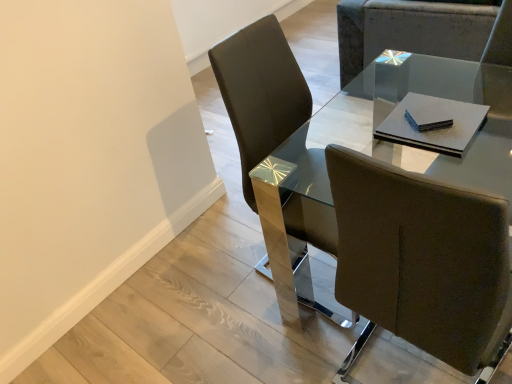
What is the approximate height of brown leather chair at center, the second chair when ordered from back to front?

It is 3.39 feet.

This screenshot has height=384, width=512. Identify the location of glass/metal table at center. (372, 156).

Find the location of a particular element. The height and width of the screenshot is (384, 512). matte brown chair at upper right, which is counted as the 1th chair, starting from the back is located at coordinates (411, 30).

Is glass/metal table at center thinner than brown leather chair at center, which is the 2th chair from right to left?

In fact, glass/metal table at center might be wider than brown leather chair at center, which is the 2th chair from right to left.

From the picture: Considering the sizes of objects glass/metal table at center and brown leather chair at center, which is the 2th chair from right to left, in the image provided, who is shorter, glass/metal table at center or brown leather chair at center, which is the 2th chair from right to left,?

glass/metal table at center.

Which object is positioned more to the left, glass/metal table at center or brown leather chair at center, which is the 2th chair from right to left?

brown leather chair at center, which is the 2th chair from right to left, is more to the left.

Identify the location of the 1st chair behind the glass/metal table at center, starting your count from the anchor. The image size is (512, 384). (260, 92).

Which is in front, point (275, 34) or point (271, 217)?

Point (271, 217)

From the image's perspective, which chair is the 1st one above the glass/metal table at center? Please provide its 2D coordinates.

[(260, 92)]

Is brown leather chair at center, the first chair when ordered from left to right, with glass/metal table at center?

No, brown leather chair at center, the first chair when ordered from left to right, is not beside glass/metal table at center.

From their relative heights in the image, would you say brown leather chair at center, the first chair when ordered from bottom to top, is taller or shorter than glass/metal table at center?

Considering their sizes, brown leather chair at center, the first chair when ordered from bottom to top, has more height than glass/metal table at center.

Is brown leather chair at center, which ranks as the 2th chair in top-to-bottom order, facing towards matte brown chair at upper right, the 1th chair positioned from the right?

No.

Is brown leather chair at center, the first chair when ordered from bottom to top, to the left of matte brown chair at upper right, which is counted as the 2th chair, starting from the bottom, from the viewer's perspective?

Yes, brown leather chair at center, the first chair when ordered from bottom to top, is to the left of matte brown chair at upper right, which is counted as the 2th chair, starting from the bottom.

In terms of size, does brown leather chair at center, arranged as the first chair when viewed from the front, appear bigger or smaller than matte brown chair at upper right, which is the 1th chair from top to bottom?

brown leather chair at center, arranged as the first chair when viewed from the front, is smaller than matte brown chair at upper right, which is the 1th chair from top to bottom.

Visually, is matte brown chair at upper right, which is counted as the 1th chair, starting from the back, positioned to the left or to the right of brown leather chair at center, which is the 2th chair from right to left?

Based on their positions, matte brown chair at upper right, which is counted as the 1th chair, starting from the back, is located to the right of brown leather chair at center, which is the 2th chair from right to left.

Is matte brown chair at upper right, the 1th chair positioned from the right, far away from brown leather chair at center, the first chair when ordered from left to right?

Yes, matte brown chair at upper right, the 1th chair positioned from the right, and brown leather chair at center, the first chair when ordered from left to right, are located far from each other.

From a real-world perspective, which is physically above, matte brown chair at upper right, which is the 1th chair from top to bottom, or brown leather chair at center, which ranks as the 2th chair in top-to-bottom order?

In real-world perspective, brown leather chair at center, which ranks as the 2th chair in top-to-bottom order, is above.

Who is shorter, matte brown chair at upper right, which is the 1th chair from top to bottom, or brown leather chair at center, the second chair when ordered from back to front?

Standing shorter between the two is matte brown chair at upper right, which is the 1th chair from top to bottom.

Is glass/metal table at center in front of or behind matte brown chair at upper right, which ranks as the second chair in left-to-right order, in the image?

Clearly, glass/metal table at center is in front of matte brown chair at upper right, which ranks as the second chair in left-to-right order.

Is glass/metal table at center next to matte brown chair at upper right, which ranks as the second chair in left-to-right order?

glass/metal table at center and matte brown chair at upper right, which ranks as the second chair in left-to-right order, are clearly separated.

Between glass/metal table at center and matte brown chair at upper right, the 1th chair positioned from the right, which one has larger width?

With larger width is matte brown chair at upper right, the 1th chair positioned from the right.

From the image's perspective, is glass/metal table at center beneath matte brown chair at upper right, which is the 2th chair from front to back?

Result: Yes.

Considering the relative sizes of matte brown chair at upper right, which is counted as the 2th chair, starting from the bottom, and glass/metal table at center in the image provided, is matte brown chair at upper right, which is counted as the 2th chair, starting from the bottom, wider than glass/metal table at center?

Yes.

Starting from the glass/metal table at center, which chair is the 2nd one behind? Please provide its 2D coordinates.

[(411, 30)]

Does matte brown chair at upper right, the 1th chair positioned from the right, have a greater height compared to glass/metal table at center?

No.

Is matte brown chair at upper right, the 1th chair positioned from the right, positioned far away from glass/metal table at center?

They are positioned close to each other.

You are a GUI agent. You are given a task and a screenshot of the screen. Output one action in this format:
    pyautogui.click(x=<x>, y=<y>)
    Task: Click on the table on the right of brown leather chair at center, which ranks as the 2th chair in top-to-bottom order
    The height and width of the screenshot is (384, 512).
    Given the screenshot: What is the action you would take?
    pyautogui.click(x=372, y=156)

Locate an element on the screen. This screenshot has height=384, width=512. table located underneath the brown leather chair at center, the first chair when ordered from left to right (from a real-world perspective) is located at coordinates (372, 156).

When comparing their distances from brown leather chair at center, which ranks as the 2th chair in top-to-bottom order, does glass/metal table at center or matte brown chair at upper right, which is the 1th chair from top to bottom, seem further?

matte brown chair at upper right, which is the 1th chair from top to bottom, lies further to brown leather chair at center, which ranks as the 2th chair in top-to-bottom order, than the other object.

Estimate the real-world distances between objects in this image. Which object is closer to brown leather chair at center, the first chair when ordered from bottom to top, matte brown chair at upper right, which is the 1th chair from top to bottom, or glass/metal table at center?

glass/metal table at center is positioned closer to the anchor brown leather chair at center, the first chair when ordered from bottom to top.

Looking at the image, which one is located closer to glass/metal table at center, brown leather chair at center, the first chair when ordered from left to right, or matte brown chair at upper right, which is the 1th chair from top to bottom?

Among the two, matte brown chair at upper right, which is the 1th chair from top to bottom, is located nearer to glass/metal table at center.

From the image, which object appears to be nearer to matte brown chair at upper right, which is counted as the 1th chair, starting from the back, glass/metal table at center or brown leather chair at center, the second chair when ordered from back to front?

glass/metal table at center lies closer to matte brown chair at upper right, which is counted as the 1th chair, starting from the back, than the other object.

Which object lies nearer to the anchor point glass/metal table at center, matte brown chair at upper right, which is the 1th chair from top to bottom, or brown leather chair at center, arranged as the first chair when viewed from the front?

The object closer to glass/metal table at center is matte brown chair at upper right, which is the 1th chair from top to bottom.

Considering their positions, is brown leather chair at center, arranged as the first chair when viewed from the front, positioned closer to matte brown chair at upper right, which is the 2th chair from front to back, than glass/metal table at center?

glass/metal table at center is closer to matte brown chair at upper right, which is the 2th chair from front to back.

Identify the location of chair between glass/metal table at center and matte brown chair at upper right, the 1th chair positioned from the right, along the z-axis. (260, 92).